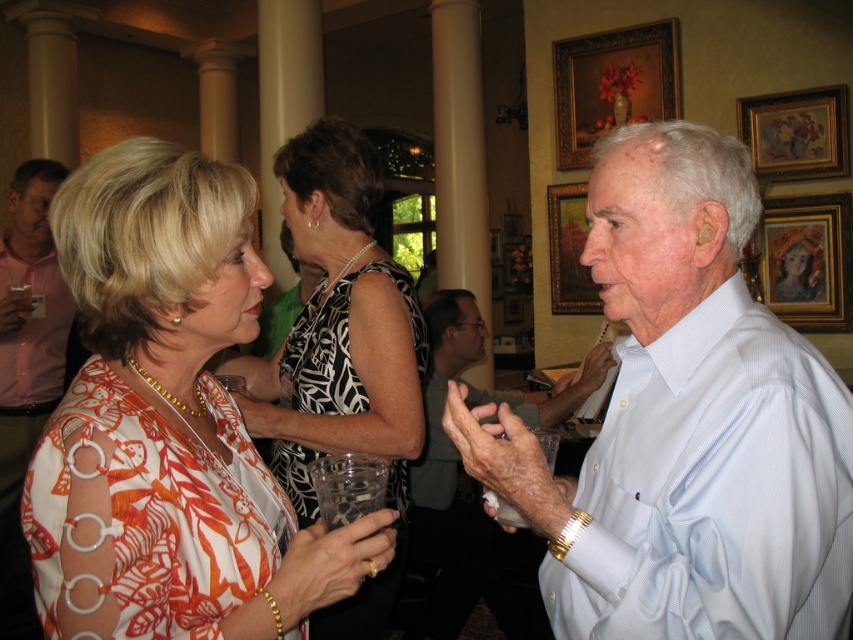
Question: Which object appears farthest from the camera in this image?

Choices:
 (A) printed fabric blouse at left
 (B) white button-down shirt at center
 (C) wooden framed portrait at upper right
 (D) wooden framed artwork at upper right

Answer: (D)

Question: Can you confirm if white button-down shirt at center is positioned to the left of pink shirt at left?

Choices:
 (A) no
 (B) yes

Answer: (A)

Question: Observing the image, what is the correct spatial positioning of white button-down shirt at center in reference to pink shirt at left?

Choices:
 (A) below
 (B) above

Answer: (B)

Question: Observing the image, what is the correct spatial positioning of white button-down shirt at center in reference to clear plastic cup at lower center?

Choices:
 (A) above
 (B) below

Answer: (B)

Question: Which is nearer to the wooden framed portrait at upper right?

Choices:
 (A) clear plastic cup at lower center
 (B) white printed dress at center
 (C) wooden framed artwork at upper right
 (D) white button-down shirt at center

Answer: (C)

Question: Which point appears closest to the camera in this image?

Choices:
 (A) (405, 337)
 (B) (714, 346)
 (C) (817, 164)

Answer: (B)